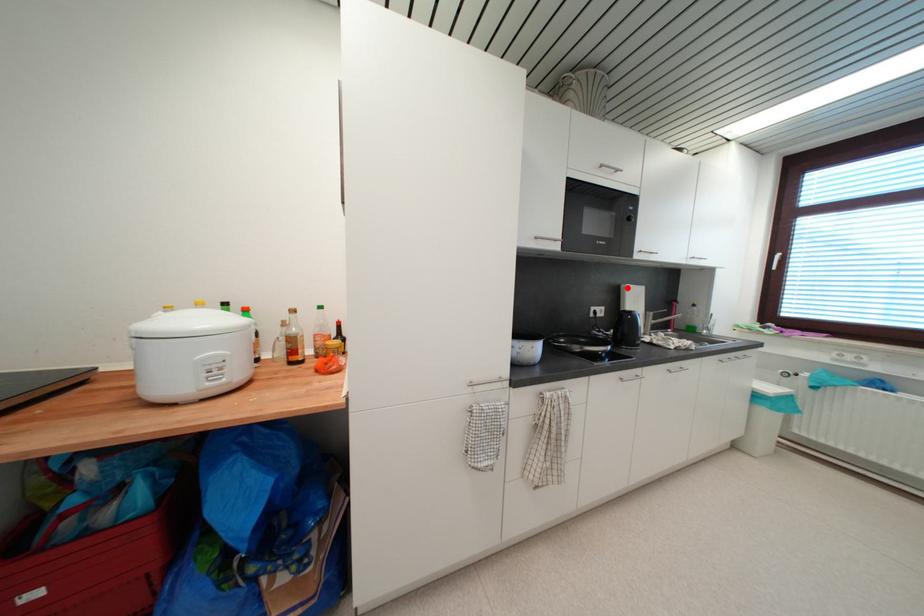
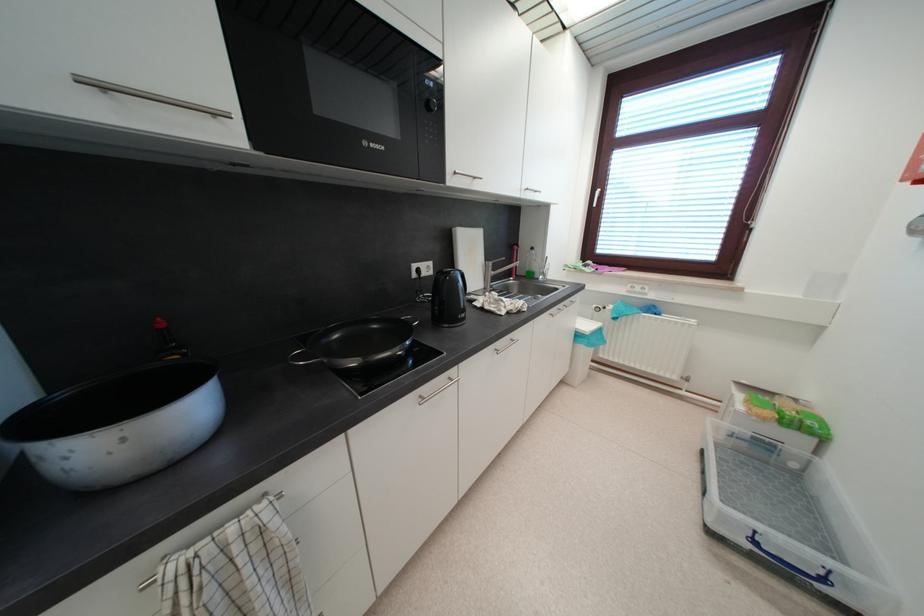
Where in the second image is the point corresponding to the highlighted location from the first image?

(458, 232)